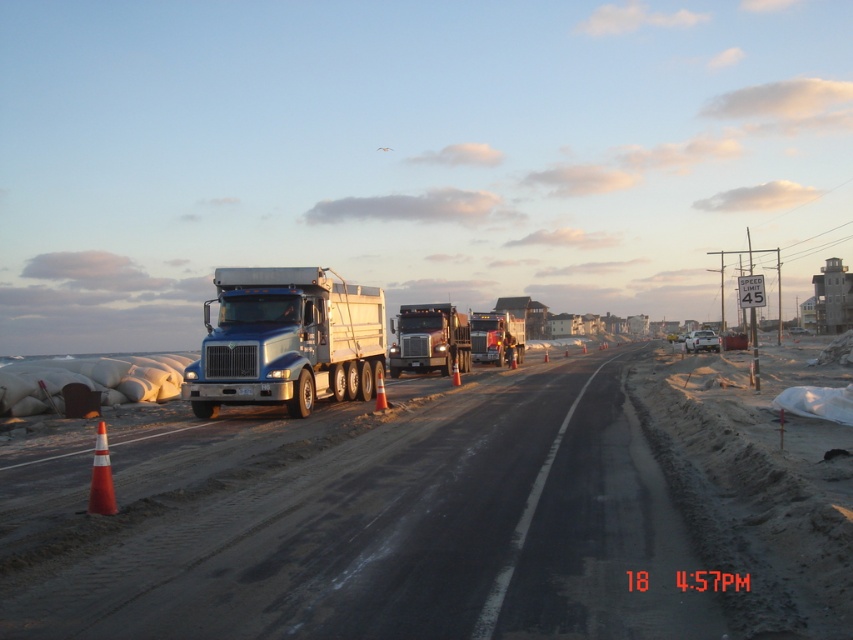
Locate an element on the screen. metallic blue truck at center is located at coordinates (357, 518).

Which is above, metallic blue truck at center or metallic silver trailer truck at center?

metallic silver trailer truck at center is higher up.

This screenshot has height=640, width=853. Describe the element at coordinates (357, 518) in the screenshot. I see `metallic blue truck at center` at that location.

The height and width of the screenshot is (640, 853). Identify the location of metallic blue truck at center. (357, 518).

Between metallic blue truck at center and metallic silver truck at center, which one appears on the left side from the viewer's perspective?

From the viewer's perspective, metallic blue truck at center appears more on the left side.

Which is behind, point (410, 502) or point (498, 356)?

Point (498, 356)

Locate an element on the screen. This screenshot has width=853, height=640. metallic blue truck at center is located at coordinates (357, 518).

Between blue metallic trailer truck at center and metallic silver truck at center, which one appears on the right side from the viewer's perspective?

From the viewer's perspective, metallic silver truck at center appears more on the right side.

Is point (305, 344) positioned in front of point (518, 332)?

Yes, point (305, 344) is closer to viewer.

You are a GUI agent. You are given a task and a screenshot of the screen. Output one action in this format:
    pyautogui.click(x=<x>, y=<y>)
    Task: Click on the blue metallic trailer truck at center
    
    Given the screenshot: What is the action you would take?
    pyautogui.click(x=286, y=340)